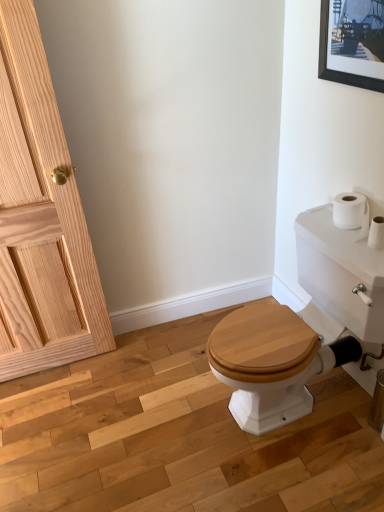
Identify the location of vacant area that is in front of natural wood door at left. The image size is (384, 512). (53, 417).